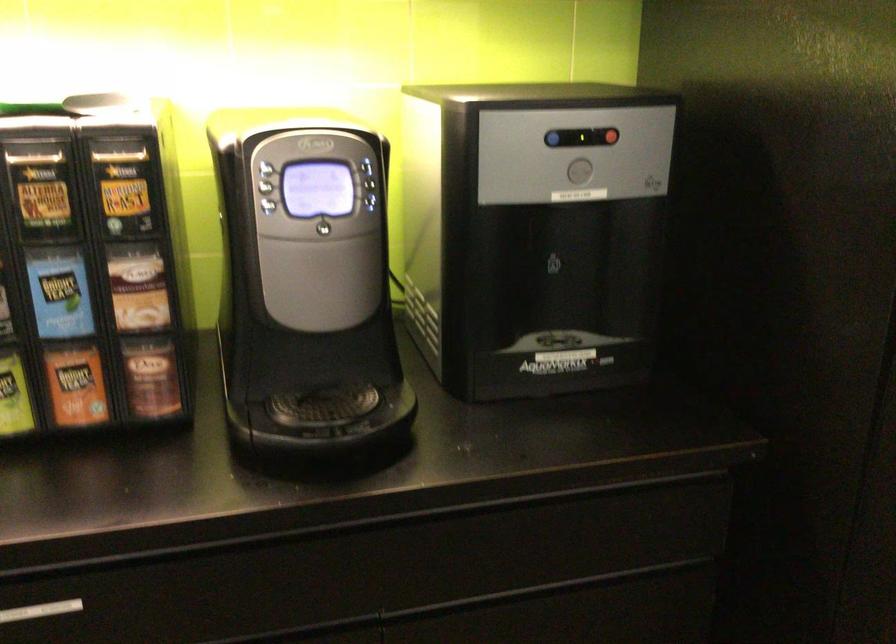
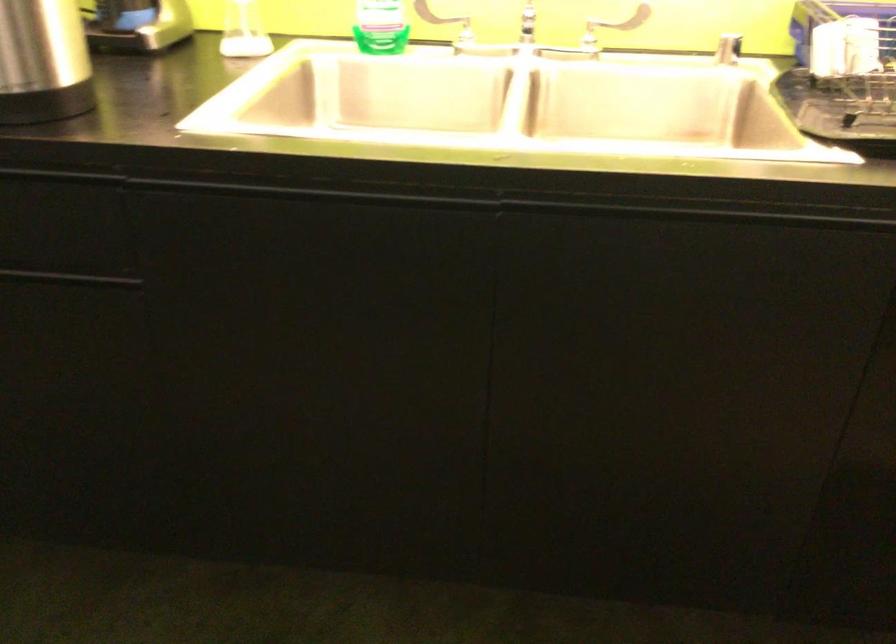
Question: What movement of the cameraman would produce the second image?

Choices:
 (A) Left
 (B) Right
 (C) Forward
 (D) Backward

Answer: (A)